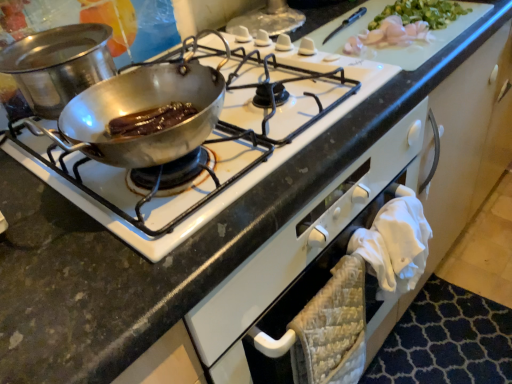
Question: From their relative heights in the image, would you say shiny silver pan at upper left is taller or shorter than shiny metal pan at upper left?

Choices:
 (A) short
 (B) tall

Answer: (B)

Question: Relative to shiny metal pan at upper left, is shiny silver pan at upper left in front or behind?

Choices:
 (A) behind
 (B) front

Answer: (A)

Question: Based on their positions, is shiny silver pan at upper left located to the left or right of shiny metal pan at upper left?

Choices:
 (A) right
 (B) left

Answer: (B)

Question: Considering the relative positions of shiny metal pan at upper left and shiny silver pan at upper left in the image provided, is shiny metal pan at upper left to the left or to the right of shiny silver pan at upper left?

Choices:
 (A) left
 (B) right

Answer: (B)

Question: From their relative heights in the image, would you say shiny metal pan at upper left is taller or shorter than shiny silver pan at upper left?

Choices:
 (A) short
 (B) tall

Answer: (A)

Question: Is shiny metal pan at upper left in front of or behind shiny silver pan at upper left in the image?

Choices:
 (A) behind
 (B) front

Answer: (B)

Question: From a real-world perspective, is shiny metal pan at upper left positioned above or below shiny silver pan at upper left?

Choices:
 (A) above
 (B) below

Answer: (B)